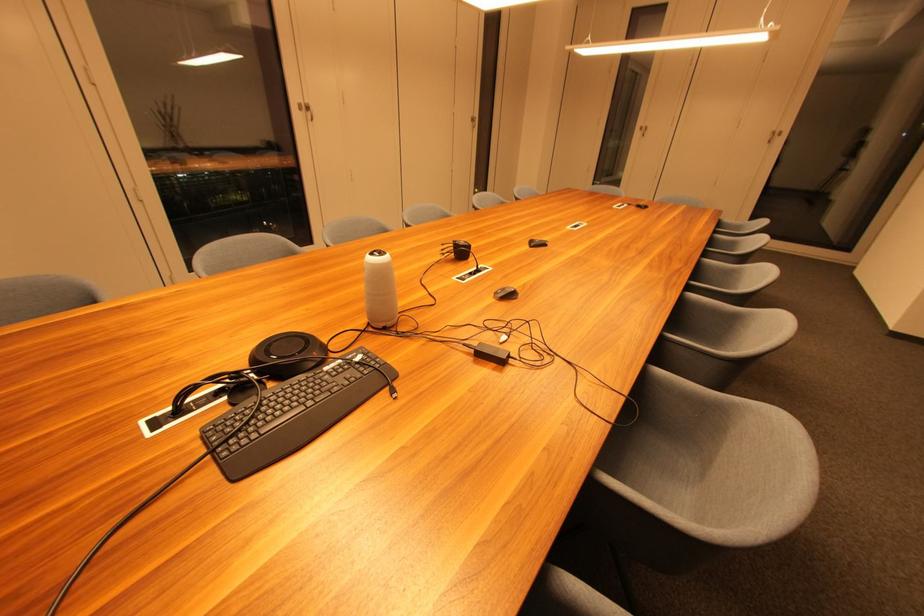
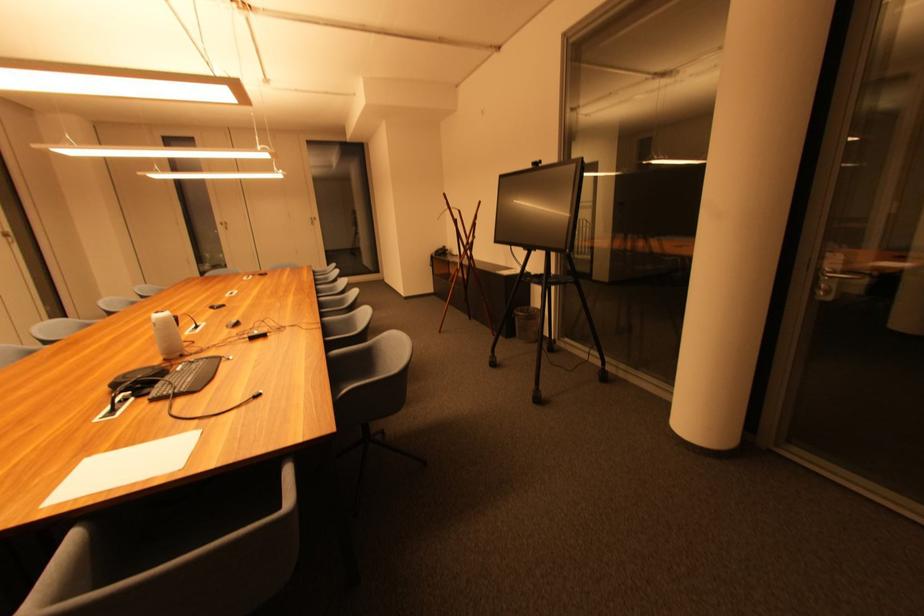
Find the pixel in the second image that matches (x=176, y=411) in the first image.

(114, 411)